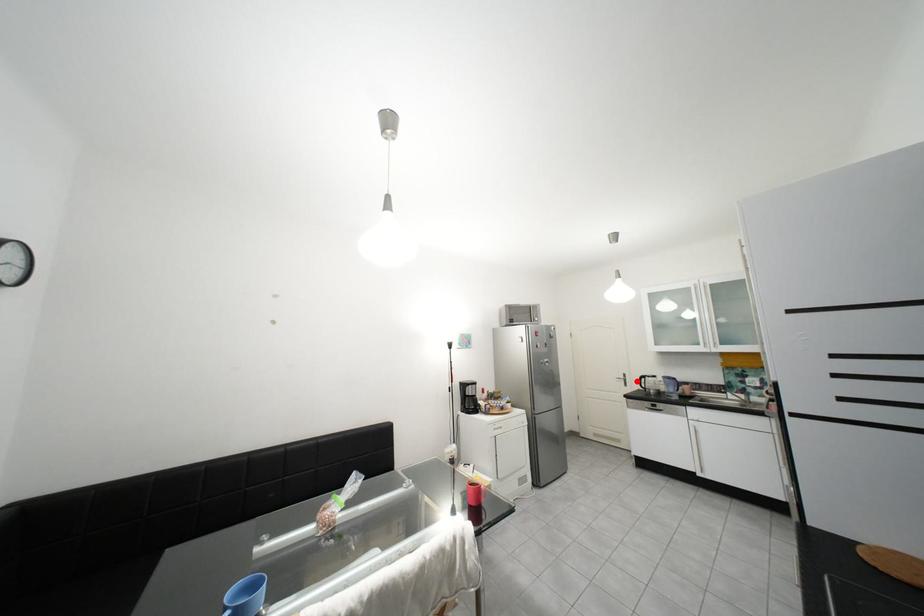
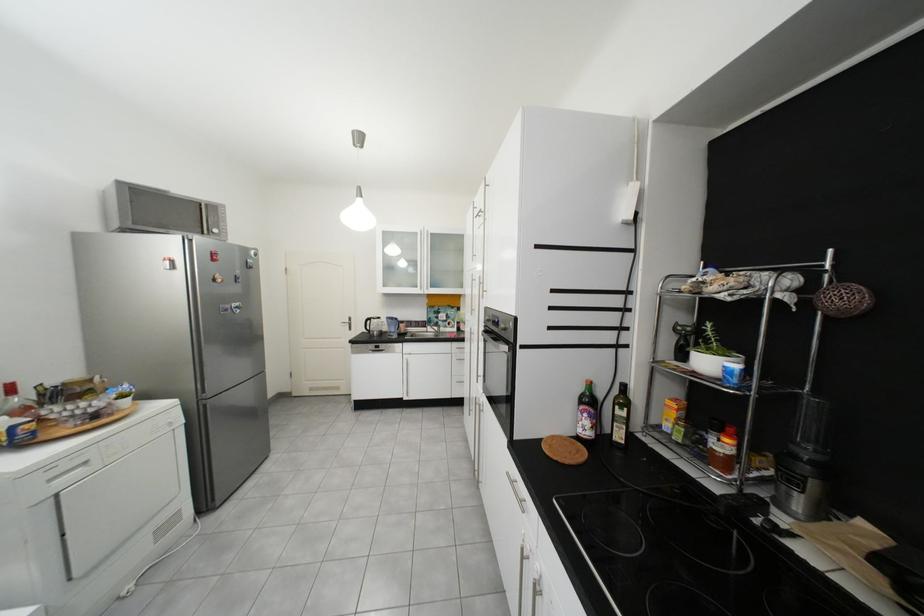
The point at the highlighted location is marked in the first image. Where is the corresponding point in the second image?

(361, 325)